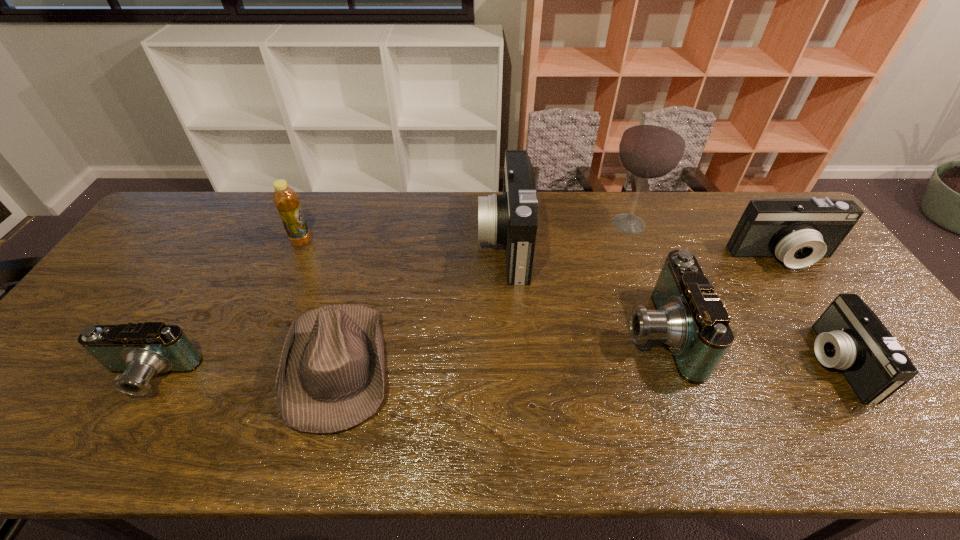
Image resolution: width=960 pixels, height=540 pixels. Identify the location of free area in between the tallest object and the second biggest black camcorder. (706, 241).

This screenshot has height=540, width=960. In order to click on free point between the sixth object from right to left and the fifth object from right to left in this screenshot , I will do `click(422, 303)`.

At what (x,y) coordinates should I click in order to perform the action: click on free space between the alcohol and the fourth object from left to right. Please return your answer as a coordinate pair (x, y). The height and width of the screenshot is (540, 960). Looking at the image, I should click on (566, 233).

The height and width of the screenshot is (540, 960). Identify the location of blank region between the left blue camcorder and the second biggest black camcorder. (465, 318).

The image size is (960, 540). Identify the location of vacant space that's between the bottle and the second smallest black camcorder. (541, 249).

Image resolution: width=960 pixels, height=540 pixels. In order to click on object that is the nearest to the smallest black camcorder in this screenshot , I will do click(798, 231).

Identify the location of object that is the sixth closest to the leftmost camcorder. (798, 231).

Identify which camcorder is the third closest to the right blue camcorder. Please provide its 2D coordinates. Your answer should be formatted as a tuple, i.e. [(x, y)], where the tuple contains the x and y coordinates of a point satisfying the conditions above.

[(850, 337)]

Choose which camcorder is the nearest neighbor to the fedora. Please provide its 2D coordinates. Your answer should be formatted as a tuple, i.e. [(x, y)], where the tuple contains the x and y coordinates of a point satisfying the conditions above.

[(140, 351)]

Identify which black camcorder is located as the nearest to the biggest black camcorder. Please provide its 2D coordinates. Your answer should be formatted as a tuple, i.e. [(x, y)], where the tuple contains the x and y coordinates of a point satisfying the conditions above.

[(798, 231)]